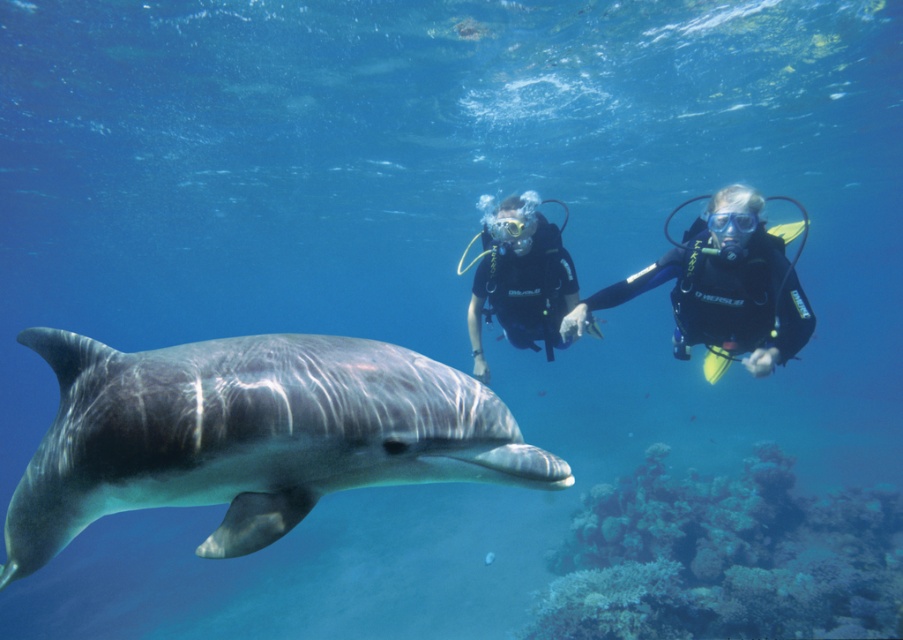
Question: Which point is closer to the camera?

Choices:
 (A) (263, 483)
 (B) (775, 240)
 (C) (478, 342)
 (D) (745, 566)

Answer: (A)

Question: Is white coral at lower right to the left of black rubber scuba divers at center from the viewer's perspective?

Choices:
 (A) no
 (B) yes

Answer: (A)

Question: Which of the following is the farthest from the observer?

Choices:
 (A) 517,224
 (B) 247,531
 (C) 724,228
 (D) 760,618

Answer: (D)

Question: Considering the relative positions of white coral at lower right and black rubber scuba divers at center in the image provided, where is white coral at lower right located with respect to black rubber scuba divers at center?

Choices:
 (A) left
 (B) right

Answer: (B)

Question: Which point is farther from the camera taking this photo?

Choices:
 (A) (721, 291)
 (B) (568, 310)
 (C) (860, 520)

Answer: (C)

Question: Is gray smooth dolphin at center smaller than black rubber scuba divers at center?

Choices:
 (A) no
 (B) yes

Answer: (B)